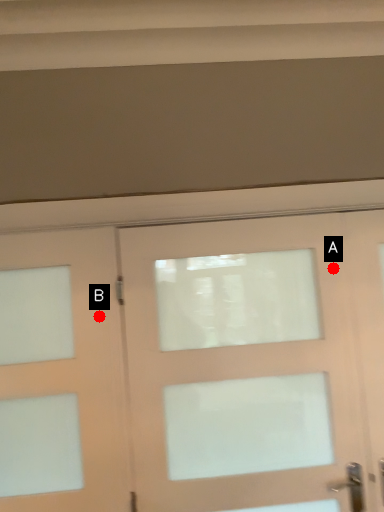
Question: Two points are circled on the image, labeled by A and B beside each circle. Which point is closer to the camera taking this photo?

Choices:
 (A) A is closer
 (B) B is closer

Answer: (B)